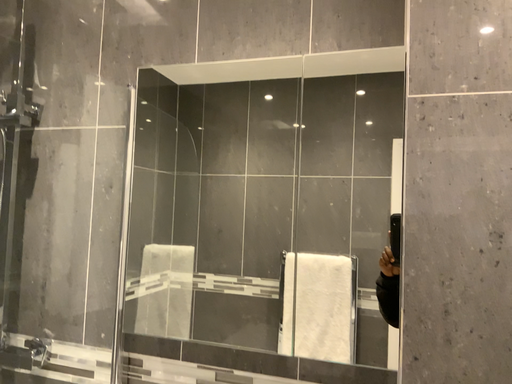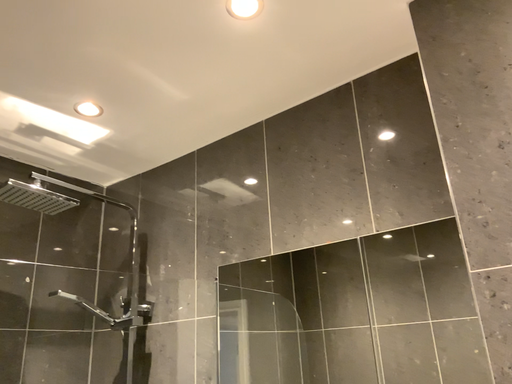
Question: How did the camera likely rotate when shooting the video?

Choices:
 (A) rotated right
 (B) rotated left

Answer: (B)